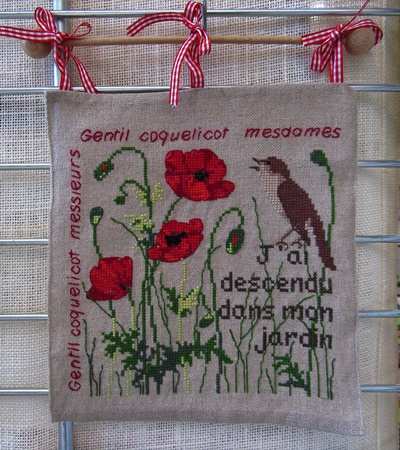
You are a GUI agent. You are given a task and a screenshot of the screen. Output one action in this format:
    pyautogui.click(x=<x>, y=<y>)
    Task: Click on the dowel
    This screenshot has height=450, width=400.
    Given the screenshot: What is the action you would take?
    pyautogui.click(x=116, y=38), pyautogui.click(x=262, y=39)